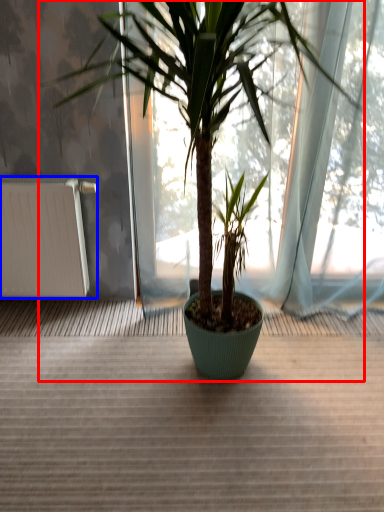
Question: Among these objects, which one is farthest to the camera, houseplant (highlighted by a red box) or radiator (highlighted by a blue box)?

Choices:
 (A) houseplant
 (B) radiator

Answer: (B)